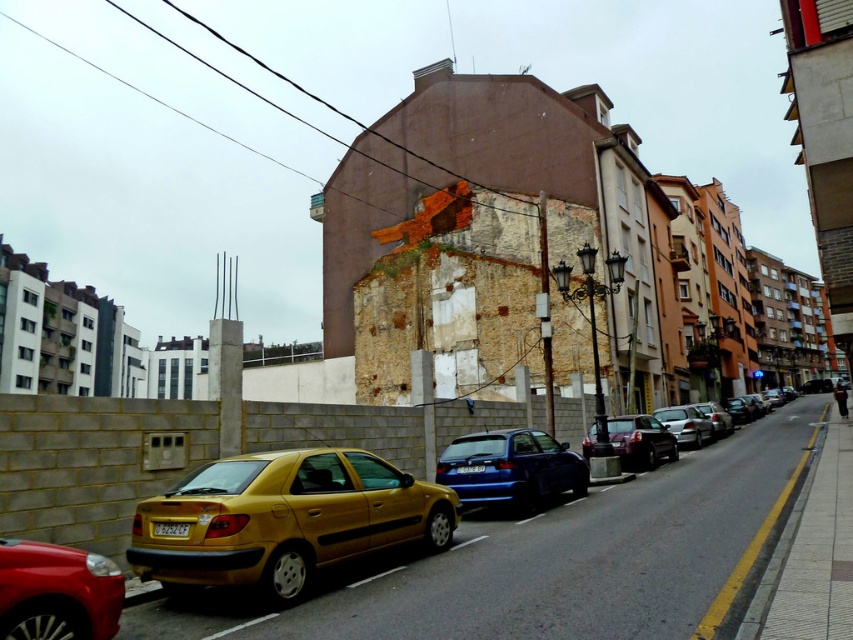
Question: Where is silver metallic sedan at right located in relation to yellow matte license plate at center in the image?

Choices:
 (A) above
 (B) below

Answer: (B)

Question: Which object appears farthest from the camera in this image?

Choices:
 (A) metallic silver sedan at center-right
 (B) silver metallic sedan at right
 (C) blue plastic license plate at center
 (D) yellow matte license plate at center

Answer: (B)

Question: Considering the relative positions of gold matte taxi at lower left and blue plastic license plate at center in the image provided, where is gold matte taxi at lower left located with respect to blue plastic license plate at center?

Choices:
 (A) below
 (B) above

Answer: (B)

Question: Is the position of shiny red car at lower left less distant than that of yellow matte license plate at center?

Choices:
 (A) no
 (B) yes

Answer: (B)

Question: Which point is closer to the camera?

Choices:
 (A) (714, 428)
 (B) (341, 516)
 (C) (461, 468)

Answer: (B)

Question: Which object appears farthest from the camera in this image?

Choices:
 (A) shiny red car at lower left
 (B) blue plastic license plate at center
 (C) metallic blue hatchback at center
 (D) shiny metallic car at center

Answer: (D)